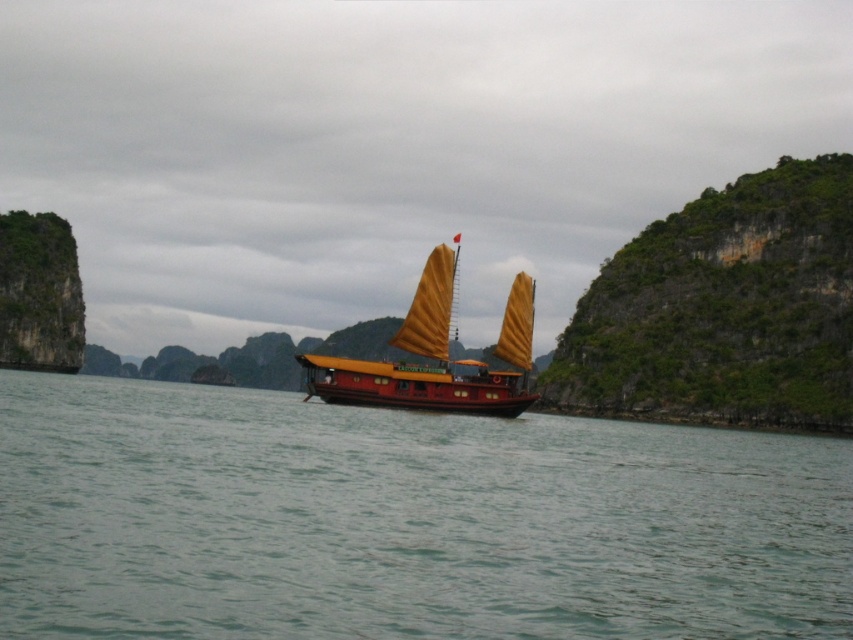
You are a photographer trying to capture the shiny red wood boat at center in your shot. The clear water at center is reflecting the boat. Which object will occupy more space in your photo?

The clear water at center is bigger than the shiny red wood boat at center, so the clear water at center will occupy more space in the photo.

You are standing on the deck of the shiny red wood boat at center. Looking down, you see the clear water at center below you. Can you see the bottom of the boat in the water?

The clear water at center is located below the shiny red wood boat at center, so yes, you can see the bottom of the shiny red wood boat at center through the clear water at center.